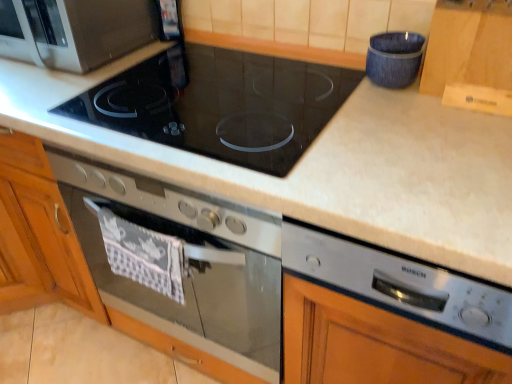
Locate an element on the screen. This screenshot has width=512, height=384. blue textured fabric at upper right, which is counted as the second appliance, starting from the front is located at coordinates (394, 58).

Describe the element at coordinates (220, 104) in the screenshot. I see `black glass cooktop at center` at that location.

Find the location of `satin silver dishwasher at lower right, marked as the 2th appliance in a back-to-front arrangement`. satin silver dishwasher at lower right, marked as the 2th appliance in a back-to-front arrangement is located at coordinates (401, 285).

I want to click on blue textured fabric at upper right, marked as the first appliance in a top-to-bottom arrangement, so click(x=394, y=58).

In the scene shown: Which of these two, satin silver oven at center or blue textured fabric at upper right, the first appliance from the back, is smaller?

blue textured fabric at upper right, the first appliance from the back.

From the image's perspective, between satin silver oven at center and blue textured fabric at upper right, the first appliance from the back, who is located below?

From the image's view, satin silver oven at center is below.

Based on the photo, considering the positions of objects satin silver oven at center and blue textured fabric at upper right, the first appliance from the back, in the image provided, who is in front, satin silver oven at center or blue textured fabric at upper right, the first appliance from the back,?

satin silver oven at center is in front.

How many degrees apart are the facing directions of satin silver oven at center and blue textured fabric at upper right, the first appliance from the back?

3.74 degrees.

From the image's perspective, between blue textured fabric at upper right, marked as the first appliance in a top-to-bottom arrangement, and satin silver dishwasher at lower right, placed as the second appliance when sorted from top to bottom, which one is located above?

blue textured fabric at upper right, marked as the first appliance in a top-to-bottom arrangement, from the image's perspective.

How much distance is there between blue textured fabric at upper right, which is counted as the second appliance, starting from the front, and satin silver dishwasher at lower right, marked as the 2th appliance in a back-to-front arrangement?

A distance of 19.73 inches exists between blue textured fabric at upper right, which is counted as the second appliance, starting from the front, and satin silver dishwasher at lower right, marked as the 2th appliance in a back-to-front arrangement.

Is blue textured fabric at upper right, marked as the first appliance in a top-to-bottom arrangement, shorter than satin silver dishwasher at lower right, marked as the 2th appliance in a back-to-front arrangement?

Yes.

Considering the relative positions of blue textured fabric at upper right, the first appliance from the back, and satin silver dishwasher at lower right, arranged as the 1th appliance when ordered from the bottom, in the image provided, is blue textured fabric at upper right, the first appliance from the back, to the left of satin silver dishwasher at lower right, arranged as the 1th appliance when ordered from the bottom, from the viewer's perspective?

Incorrect, blue textured fabric at upper right, the first appliance from the back, is not on the left side of satin silver dishwasher at lower right, arranged as the 1th appliance when ordered from the bottom.

From the image's perspective, between matte black microwave at upper left and satin silver dishwasher at lower right, arranged as the 1th appliance when ordered from the bottom, who is located below?

satin silver dishwasher at lower right, arranged as the 1th appliance when ordered from the bottom, is shown below in the image.

Between matte black microwave at upper left and satin silver dishwasher at lower right, marked as the 2th appliance in a back-to-front arrangement, which one has more height?

matte black microwave at upper left is taller.

Is matte black microwave at upper left inside or outside of satin silver dishwasher at lower right, placed as the second appliance when sorted from top to bottom?

matte black microwave at upper left is located beyond the bounds of satin silver dishwasher at lower right, placed as the second appliance when sorted from top to bottom.

Can we say matte black microwave at upper left lies outside blue textured fabric at upper right, marked as the first appliance in a top-to-bottom arrangement?

matte black microwave at upper left is positioned outside blue textured fabric at upper right, marked as the first appliance in a top-to-bottom arrangement.

Is matte black microwave at upper left positioned before blue textured fabric at upper right, which is counted as the second appliance, starting from the front?

No, it is not.

Could you tell me if matte black microwave at upper left is turned towards blue textured fabric at upper right, marked as the first appliance in a top-to-bottom arrangement?

No.

From the image's perspective, between matte black microwave at upper left and blue textured fabric at upper right, the first appliance from the back, which one is located above?

matte black microwave at upper left, from the image's perspective.

From the image's perspective, between blue textured fabric at upper right, the first appliance from the back, and matte black microwave at upper left, which one is located above?

matte black microwave at upper left.

Are blue textured fabric at upper right, the first appliance from the back, and matte black microwave at upper left beside each other?

No, blue textured fabric at upper right, the first appliance from the back, is not touching matte black microwave at upper left.

From the image's perspective, is satin silver oven at center located above black glass cooktop at center?

No, from the image's perspective, satin silver oven at center is not over black glass cooktop at center.

Is black glass cooktop at center a part of satin silver oven at center?

No.

Are satin silver oven at center and black glass cooktop at center beside each other?

satin silver oven at center and black glass cooktop at center are clearly separated.

Could you tell me if satin silver oven at center is turned towards black glass cooktop at center?

No, satin silver oven at center is not turned towards black glass cooktop at center.

Is blue textured fabric at upper right, positioned as the second appliance in bottom-to-top order, surrounding black glass cooktop at center?

Definitely not — black glass cooktop at center is not inside blue textured fabric at upper right, positioned as the second appliance in bottom-to-top order.

From the image's perspective, is blue textured fabric at upper right, marked as the first appliance in a top-to-bottom arrangement, above or below black glass cooktop at center?

Based on their image positions, blue textured fabric at upper right, marked as the first appliance in a top-to-bottom arrangement, is located above black glass cooktop at center.

Considering the sizes of objects blue textured fabric at upper right, which is counted as the second appliance, starting from the front, and black glass cooktop at center in the image provided, who is thinner, blue textured fabric at upper right, which is counted as the second appliance, starting from the front, or black glass cooktop at center?

blue textured fabric at upper right, which is counted as the second appliance, starting from the front, is thinner.

Is blue textured fabric at upper right, the first appliance from the back, oriented towards black glass cooktop at center?

No, blue textured fabric at upper right, the first appliance from the back, is not aimed at black glass cooktop at center.

Where is `home appliance to the left of blue textured fabric at upper right, marked as the first appliance in a top-to-bottom arrangement`? This screenshot has height=384, width=512. home appliance to the left of blue textured fabric at upper right, marked as the first appliance in a top-to-bottom arrangement is located at coordinates (189, 266).

You are a GUI agent. You are given a task and a screenshot of the screen. Output one action in this format:
    pyautogui.click(x=<x>, y=<y>)
    Task: Click on the appliance on the right side of satin silver dishwasher at lower right, placed as the second appliance when sorted from top to bottom
    
    Given the screenshot: What is the action you would take?
    tap(394, 58)

Based on their spatial positions, is matte black microwave at upper left or satin silver dishwasher at lower right, arranged as the 1th appliance when ordered from the bottom, closer to blue textured fabric at upper right, the first appliance from the back?

satin silver dishwasher at lower right, arranged as the 1th appliance when ordered from the bottom, lies closer to blue textured fabric at upper right, the first appliance from the back, than the other object.

Which object lies further to the anchor point satin silver dishwasher at lower right, placed as the second appliance when sorted from top to bottom, satin silver oven at center or black glass cooktop at center?

The object further to satin silver dishwasher at lower right, placed as the second appliance when sorted from top to bottom, is satin silver oven at center.

Based on their spatial positions, is matte black microwave at upper left or black glass cooktop at center closer to satin silver oven at center?

black glass cooktop at center lies closer to satin silver oven at center than the other object.

Based on their spatial positions, is blue textured fabric at upper right, positioned as the second appliance in bottom-to-top order, or black glass cooktop at center further from satin silver dishwasher at lower right, arranged as the 1th appliance when ordered from the bottom?

blue textured fabric at upper right, positioned as the second appliance in bottom-to-top order.

Estimate the real-world distances between objects in this image. Which object is further from black glass cooktop at center, matte black microwave at upper left or blue textured fabric at upper right, marked as the first appliance in a top-to-bottom arrangement?

The object further to black glass cooktop at center is blue textured fabric at upper right, marked as the first appliance in a top-to-bottom arrangement.

From the picture: From the image, which object appears to be nearer to satin silver oven at center, satin silver dishwasher at lower right, placed as the second appliance when sorted from top to bottom, or black glass cooktop at center?

black glass cooktop at center is closer to satin silver oven at center.

From the image, which object appears to be farther from matte black microwave at upper left, blue textured fabric at upper right, marked as the first appliance in a top-to-bottom arrangement, or satin silver dishwasher at lower right, arranged as the 1th appliance when viewed from the front?

Among the two, satin silver dishwasher at lower right, arranged as the 1th appliance when viewed from the front, is located further to matte black microwave at upper left.

Considering their positions, is black glass cooktop at center positioned further to blue textured fabric at upper right, marked as the first appliance in a top-to-bottom arrangement, than matte black microwave at upper left?

The object further to blue textured fabric at upper right, marked as the first appliance in a top-to-bottom arrangement, is matte black microwave at upper left.

Locate an element on the screen. The image size is (512, 384). gas stove between matte black microwave at upper left and satin silver oven at center from top to bottom is located at coordinates (220, 104).

The width and height of the screenshot is (512, 384). Identify the location of home appliance between blue textured fabric at upper right, the first appliance from the back, and satin silver dishwasher at lower right, marked as the 2th appliance in a back-to-front arrangement, in the up-down direction. (189, 266).

I want to click on appliance located between matte black microwave at upper left and blue textured fabric at upper right, positioned as the second appliance in bottom-to-top order, in the left-right direction, so click(401, 285).

You are a GUI agent. You are given a task and a screenshot of the screen. Output one action in this format:
    pyautogui.click(x=<x>, y=<y>)
    Task: Click on the home appliance between matte black microwave at upper left and blue textured fabric at upper right, marked as the first appliance in a top-to-bottom arrangement, in the horizontal direction
    The height and width of the screenshot is (384, 512).
    Given the screenshot: What is the action you would take?
    pyautogui.click(x=189, y=266)